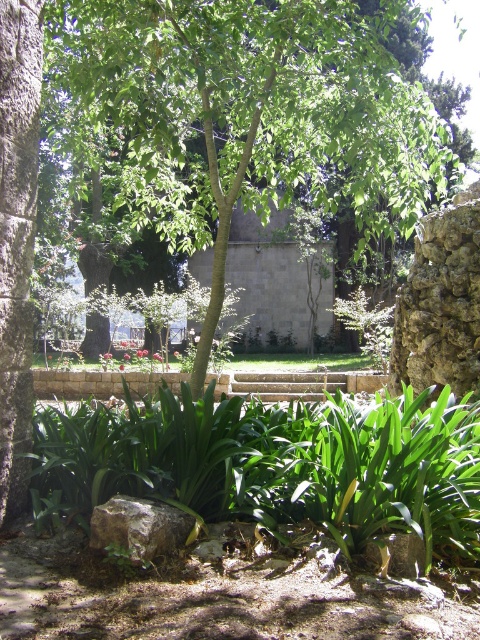
You are planning to place a new bench in the garden. The bench requires a space wider than the rusty metallic rock at center. Can the area around the green leafy tree at center accommodate the bench?

The green leafy tree at center has a width larger than the rusty metallic rock at center, so the area around the green leafy tree at center can accommodate the bench as it provides enough space.

You are standing in the garden and want to take a photo of both the point at location (441,140) and the point at location (178,536). Which point should you focus on first to ensure both are in sharp focus?

You should focus on the point at location (441,140) first because it is closer to the camera than the point at (178,536). This ensures the closer point is in focus, and the farther point will also be in focus due to the depth of field.

Based on the scene description, what object is located at the coordinates point (248, 116)?

The point (248, 116) indicates the green leafy tree at center.